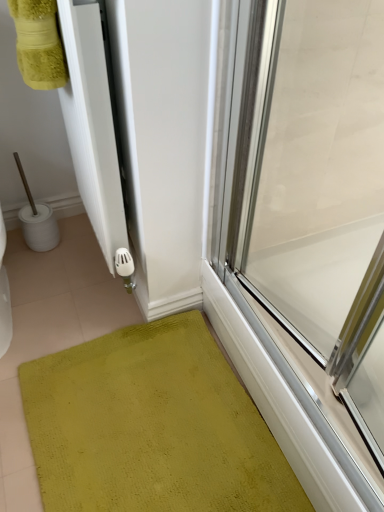
Question: Is green textured bath mat at lower left surrounding transparent glass door at right?

Choices:
 (A) yes
 (B) no

Answer: (B)

Question: From the image's perspective, does green textured bath mat at lower left appear lower than transparent glass door at right?

Choices:
 (A) yes
 (B) no

Answer: (A)

Question: Is green textured bath mat at lower left bigger than transparent glass door at right?

Choices:
 (A) yes
 (B) no

Answer: (B)

Question: Is green textured bath mat at lower left to the right of transparent glass door at right from the viewer's perspective?

Choices:
 (A) no
 (B) yes

Answer: (A)

Question: Is green textured bath mat at lower left thinner than transparent glass door at right?

Choices:
 (A) yes
 (B) no

Answer: (B)

Question: Is green textured bath mat at lower left looking in the opposite direction of transparent glass door at right?

Choices:
 (A) no
 (B) yes

Answer: (A)

Question: Does transparent glass door at right lie in front of green textured bath mat at lower left?

Choices:
 (A) no
 (B) yes

Answer: (B)

Question: Considering the relative sizes of transparent glass door at right and green textured bath mat at lower left in the image provided, is transparent glass door at right thinner than green textured bath mat at lower left?

Choices:
 (A) yes
 (B) no

Answer: (A)

Question: Considering the relative sizes of transparent glass door at right and green textured bath mat at lower left in the image provided, is transparent glass door at right wider than green textured bath mat at lower left?

Choices:
 (A) no
 (B) yes

Answer: (A)

Question: From a real-world perspective, is transparent glass door at right beneath green textured bath mat at lower left?

Choices:
 (A) yes
 (B) no

Answer: (B)

Question: Is transparent glass door at right taller than green textured bath mat at lower left?

Choices:
 (A) yes
 (B) no

Answer: (A)

Question: From the image's perspective, is transparent glass door at right on green textured bath mat at lower left?

Choices:
 (A) yes
 (B) no

Answer: (A)

Question: From a real-world perspective, is green textured bath mat at lower left above or below transparent glass door at right?

Choices:
 (A) below
 (B) above

Answer: (A)